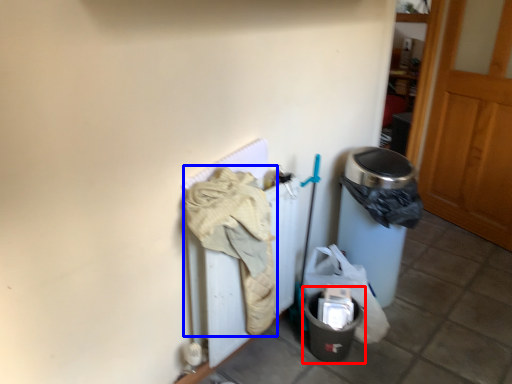
Question: Which object appears farthest to the camera in this image, recycling bin (highlighted by a red box) or clothing (highlighted by a blue box)?

Choices:
 (A) recycling bin
 (B) clothing

Answer: (A)